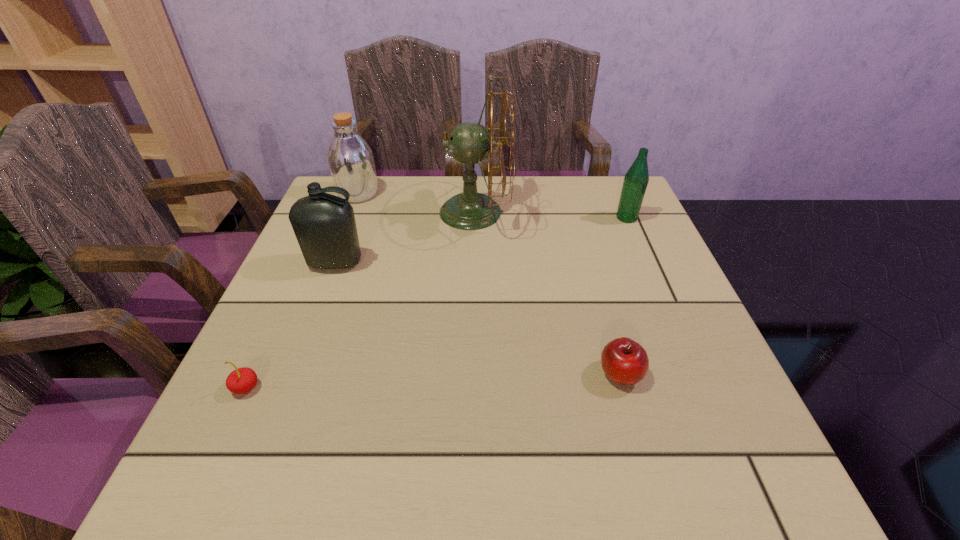
Locate an element on the screen. This screenshot has height=540, width=960. free space between the third object from right to left and the second nearest bottle is located at coordinates (550, 215).

This screenshot has height=540, width=960. I want to click on vacant space that's between the farthest bottle and the third object from right to left, so click(x=416, y=202).

At what (x,y) coordinates should I click in order to perform the action: click on empty space between the fifth object from left to right and the cherry. Please return your answer as a coordinate pair (x, y). Looking at the image, I should click on (433, 381).

Identify the location of vacant space that's between the cherry and the nearest bottle. (291, 325).

The height and width of the screenshot is (540, 960). I want to click on empty space between the third nearest object and the rightmost bottle, so click(x=481, y=240).

Where is `the fifth closest object to the cherry`? the fifth closest object to the cherry is located at coordinates (636, 179).

Where is `the fifth closest object to the apple`? The height and width of the screenshot is (540, 960). the fifth closest object to the apple is located at coordinates (350, 158).

Identify the location of the closest bottle to the fourth farthest object. (350, 158).

Locate which bottle ranks third in proximity to the cherry. Please provide its 2D coordinates. Your answer should be formatted as a tuple, i.e. [(x, y)], where the tuple contains the x and y coordinates of a point satisfying the conditions above.

[(636, 179)]

You are a GUI agent. You are given a task and a screenshot of the screen. Output one action in this format:
    pyautogui.click(x=<x>, y=<y>)
    Task: Click on the vacant position in the image that satisfies the following two spatial constraints: 1. on the back side of the apple; 2. on the left side of the cherry
    Image resolution: width=960 pixels, height=540 pixels.
    Given the screenshot: What is the action you would take?
    pyautogui.click(x=252, y=374)